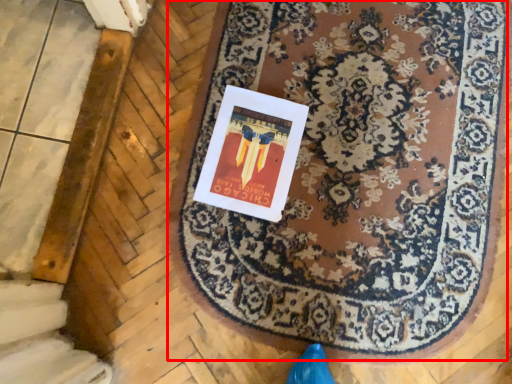
Question: From the image, what is the correct spatial relationship of mat (annotated by the red box) in relation to postcard?

Choices:
 (A) right
 (B) left

Answer: (A)